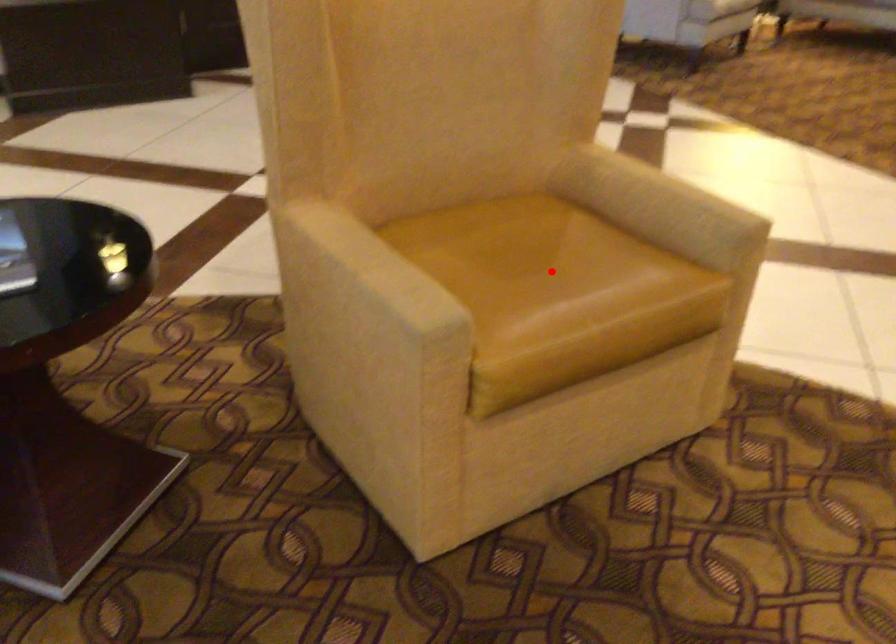
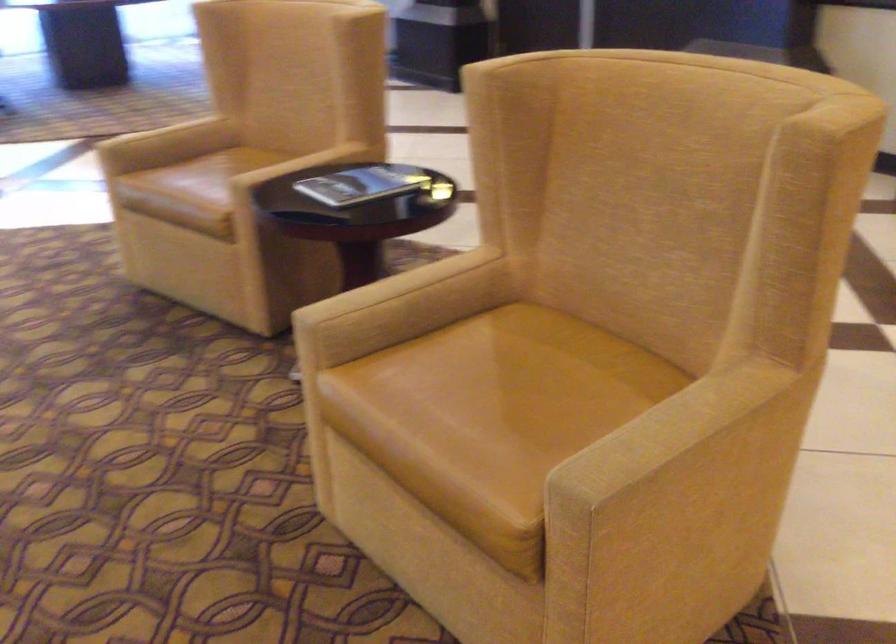
Locate, in the second image, the point that corresponds to the highlighted location in the first image.

(500, 398)